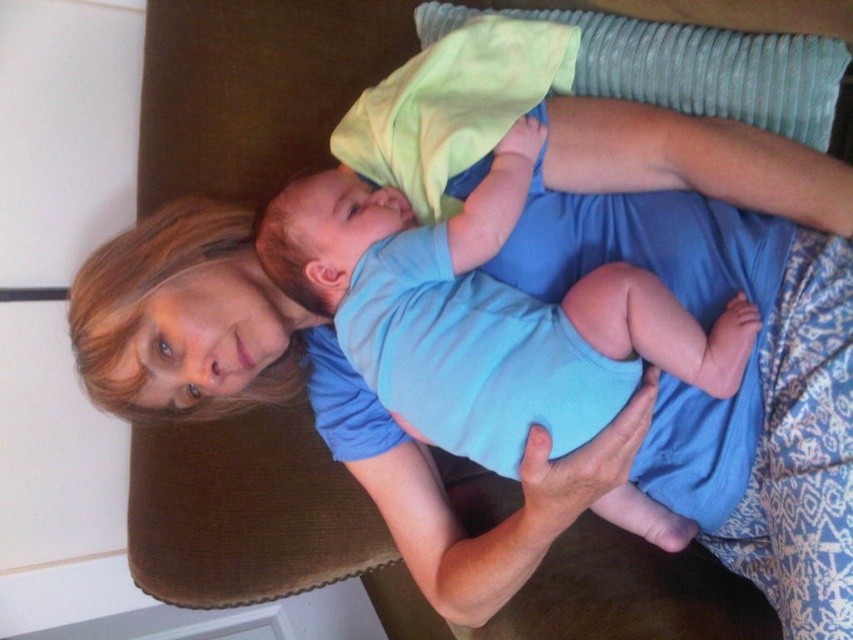
Question: Is blue cotton onesie at center closer to the viewer compared to textured gray pillow at upper center?

Choices:
 (A) no
 (B) yes

Answer: (B)

Question: Which of the following is the farthest from the observer?

Choices:
 (A) (408, 225)
 (B) (722, 45)

Answer: (B)

Question: Does blue cotton onesie at center appear on the left side of textured gray pillow at upper center?

Choices:
 (A) no
 (B) yes

Answer: (B)

Question: Can you confirm if blue cotton onesie at center is smaller than textured gray pillow at upper center?

Choices:
 (A) no
 (B) yes

Answer: (A)

Question: Which of the following is the closest to the observer?

Choices:
 (A) textured gray pillow at upper center
 (B) blue cotton onesie at center

Answer: (B)